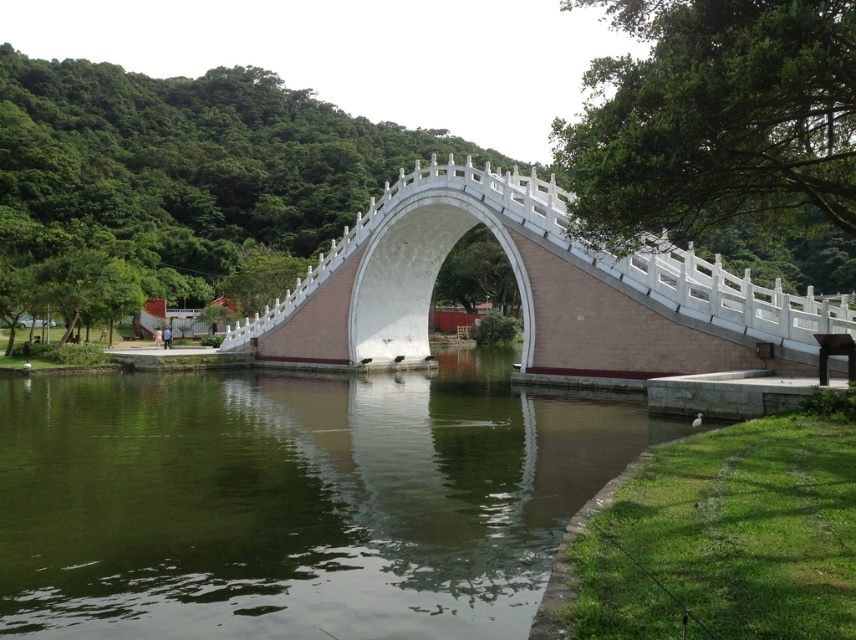
You are a painter wanting to capture the scene. You notice the green smooth water at center and the white stone bridge at center. Which one appears wider in the image?

The green smooth water at center appears wider than the white stone bridge at center according to the description.

You are a drone operator trying to capture the reflection of the arched bridge in the green smooth water at center. Based on the coordinates provided, can you confirm if the water is positioned to allow a clear reflection of the bridge?

The green smooth water at center is positioned at point (294, 500), which is the correct location to capture the reflection of the arched bridge as described in the scene.

You are a painter standing on the grassy area near the bridge entrance. You want to paint the green smooth water at center and the white stone bridge at center. Which object should you paint first if you follow the left to right painting order?

You should paint the green smooth water at center first because it is located to the left of the white stone bridge at center, following the left to right painting order.